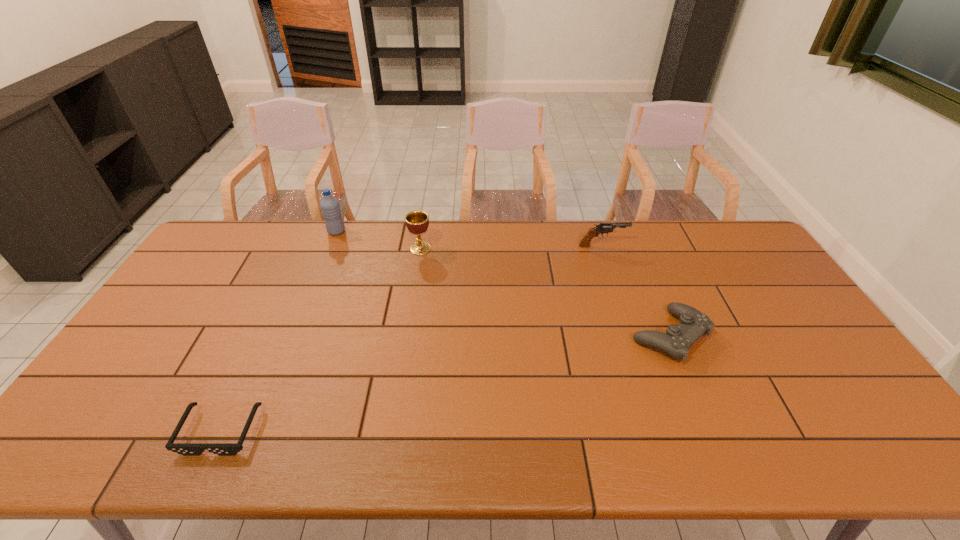
Locate an element on the screen. The width and height of the screenshot is (960, 540). free space located 0.160m on the front of the third object from right to left is located at coordinates (414, 288).

I want to click on vacant space situated 0.350m along the barrel of the gun, so click(x=725, y=246).

The image size is (960, 540). Identify the location of free space located on the front of the second shortest object. (709, 434).

Find the location of a particular element. water bottle positioned at the far edge is located at coordinates (330, 208).

This screenshot has height=540, width=960. What are the coordinates of `chalice that is positioned at the far edge` in the screenshot? It's located at (417, 222).

Locate an element on the screen. The image size is (960, 540). gun at the far edge is located at coordinates (604, 227).

Locate an element on the screen. This screenshot has height=540, width=960. object at the near edge is located at coordinates (186, 449).

Locate an element on the screen. The height and width of the screenshot is (540, 960). free region at the far edge of the desktop is located at coordinates (465, 229).

In the image, there is a desktop. Where is `vacant region at the near edge`? vacant region at the near edge is located at coordinates (764, 428).

This screenshot has height=540, width=960. In the image, there is a desktop. In order to click on vacant space at the left edge in this screenshot , I will do `click(201, 273)`.